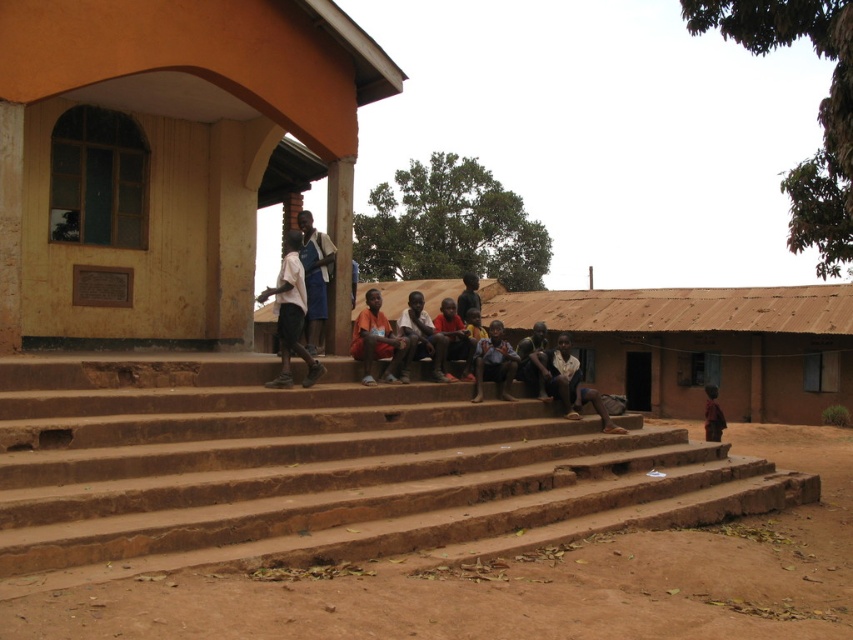
Can you confirm if white shirt at center is shorter than brown fabric shirt at center?

In fact, white shirt at center may be taller than brown fabric shirt at center.

What are the coordinates of `white shirt at center` in the screenshot? It's located at [289, 314].

Between point (294, 259) and point (480, 381), which one is positioned behind?

The point (480, 381) is behind.

The width and height of the screenshot is (853, 640). Identify the location of white shirt at center. (289, 314).

Does white shirt at center appear under dark brown fabric shirt at center?

No.

Looking at this image, who is more forward, [291,348] or [572,362]?

Point [291,348] is more forward.

I want to click on white shirt at center, so click(x=289, y=314).

Is white shirt at center to the right of orange fabric shirt at center from the viewer's perspective?

Incorrect, white shirt at center is not on the right side of orange fabric shirt at center.

This screenshot has width=853, height=640. Describe the element at coordinates (289, 314) in the screenshot. I see `white shirt at center` at that location.

Which is in front, point (292, 330) or point (378, 308)?

Point (292, 330) is in front.

The image size is (853, 640). I want to click on white shirt at center, so click(289, 314).